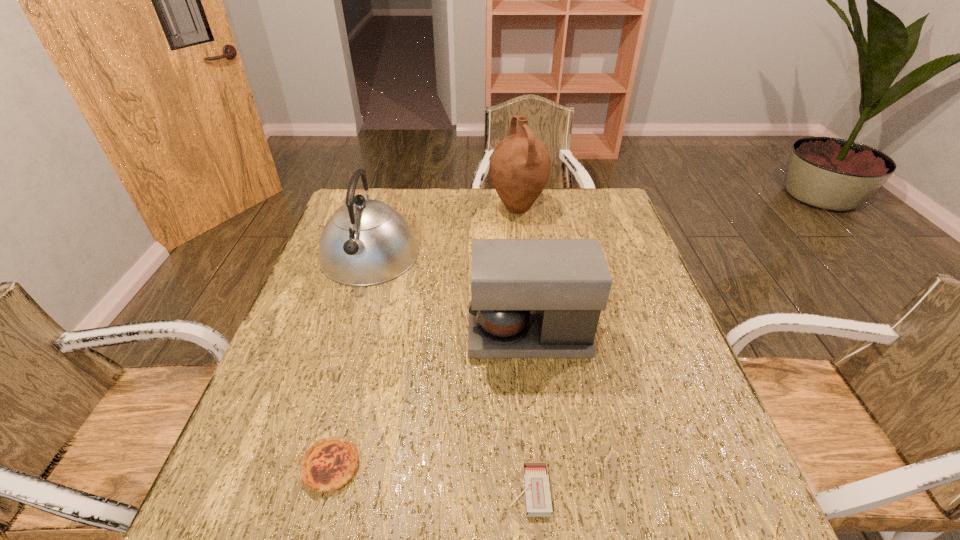
Where is `free space between the tallest object and the quiche`? Image resolution: width=960 pixels, height=540 pixels. free space between the tallest object and the quiche is located at coordinates (424, 337).

At what (x,y) coordinates should I click in order to perform the action: click on vacant point located between the quiche and the second farthest object. Please return your answer as a coordinate pair (x, y). Looking at the image, I should click on (350, 361).

Find the location of a particular element. This screenshot has width=960, height=540. free space between the quiche and the matchbox is located at coordinates (430, 478).

What are the coordinates of `object that is the second closest to the pitcher` in the screenshot? It's located at (530, 298).

Choose which object is the second nearest neighbor to the third nearest object. Please provide its 2D coordinates. Your answer should be formatted as a tuple, i.e. [(x, y)], where the tuple contains the x and y coordinates of a point satisfying the conditions above.

[(538, 503)]